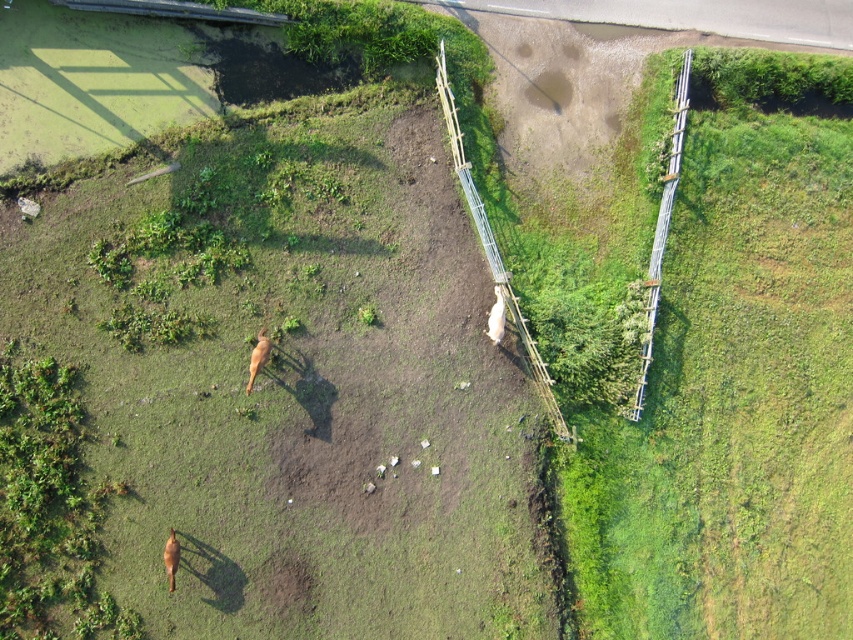
The height and width of the screenshot is (640, 853). What do you see at coordinates (662, 230) in the screenshot? I see `wooden fence at right` at bounding box center [662, 230].

Who is lower down, wooden fence at right or white fluffy dog at center?

Positioned lower is white fluffy dog at center.

Measure the distance between wooden fence at right and camera.

The distance of wooden fence at right from camera is 35.93 meters.

Where is `wooden fence at right`? This screenshot has width=853, height=640. wooden fence at right is located at coordinates (662, 230).

Is green grassy at right positioned before wooden fence at right?

Yes.

In the scene shown: Is green grassy at right wider than wooden fence at right?

Yes, green grassy at right is wider than wooden fence at right.

Is point (688, 314) positioned before point (643, 397)?

No, it is not.

Locate an element on the screen. The height and width of the screenshot is (640, 853). green grassy at right is located at coordinates (735, 380).

Does green grassy at right have a greater height compared to wooden planks at center?

Correct, green grassy at right is much taller as wooden planks at center.

Is point (608, 436) behind point (479, 204)?

Yes, point (608, 436) is behind point (479, 204).

In order to click on green grassy at right in this screenshot , I will do `click(735, 380)`.